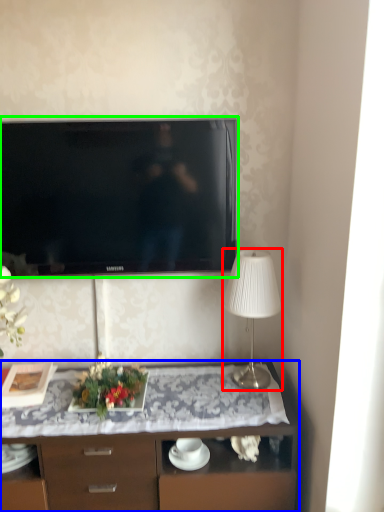
Question: Which object is positioned farthest from lamp (highlighted by a red box)? Select from desk (highlighted by a blue box) and television (highlighted by a green box).

Choices:
 (A) desk
 (B) television

Answer: (B)